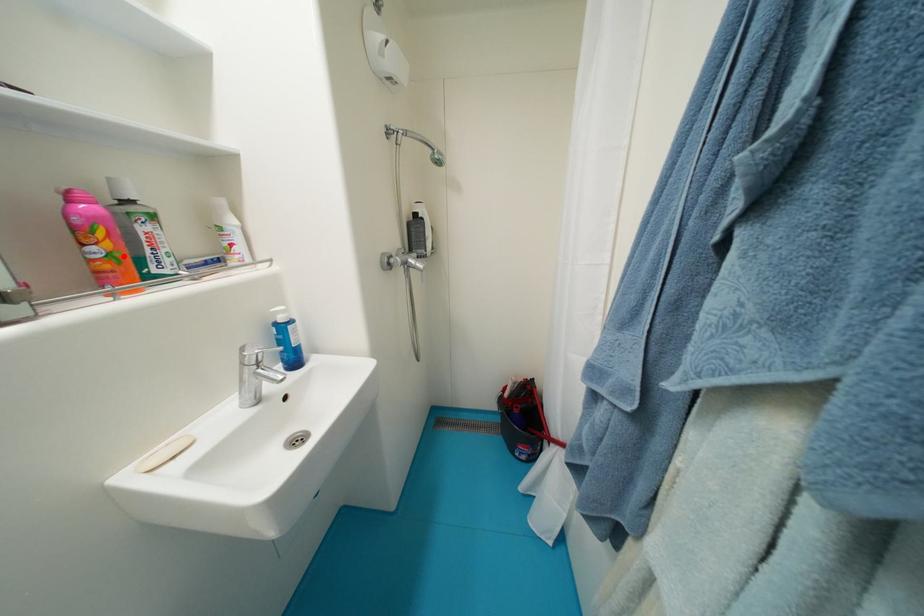
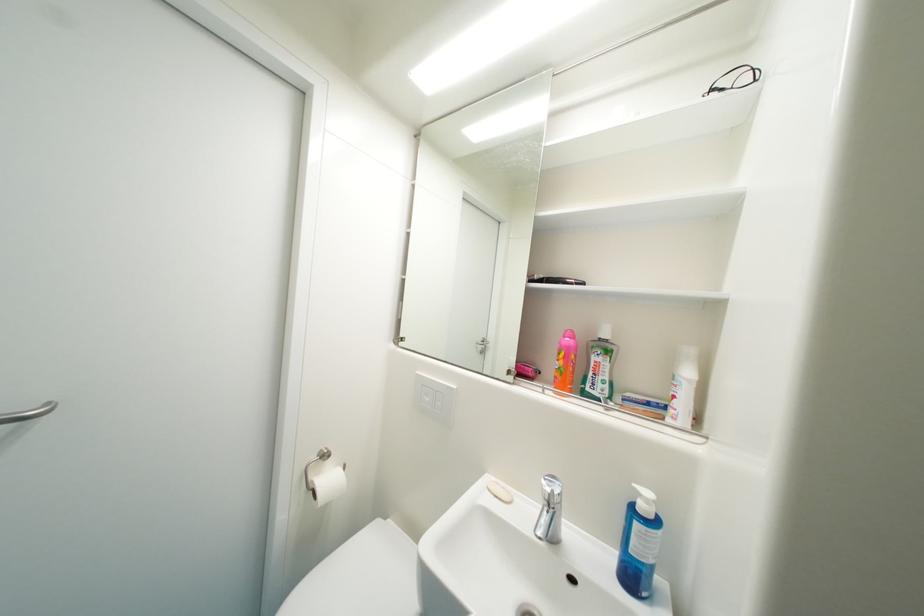
Find the pixel in the second image that matches the highlighted location in the first image.

(569, 371)